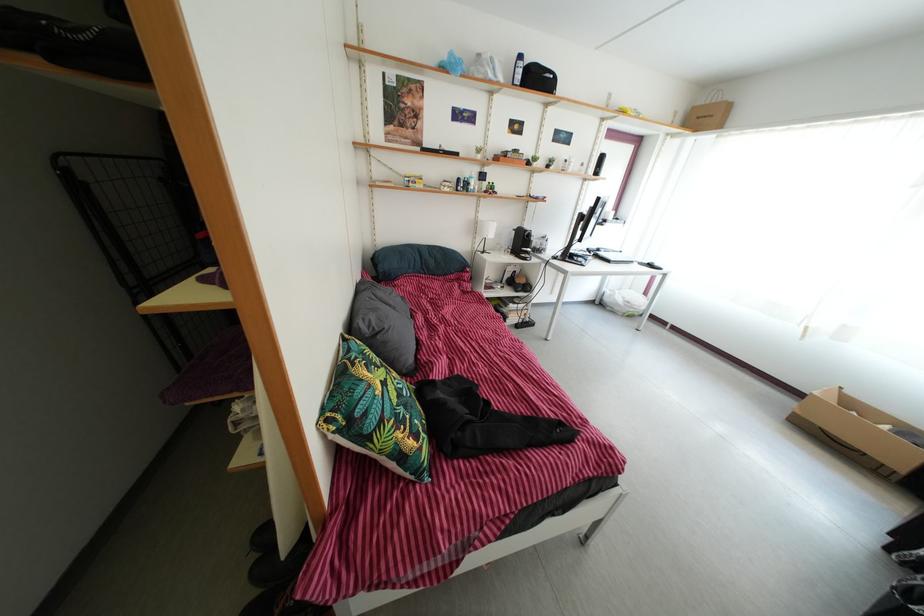
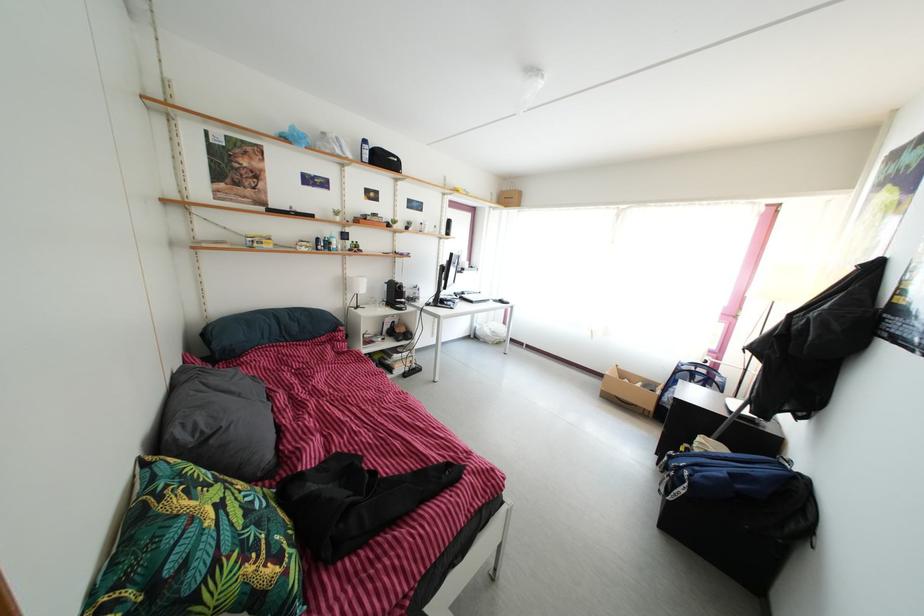
Question: The images are taken continuously from a first-person perspective. In which direction is your viewpoint rotating?

Choices:
 (A) Left
 (B) Right
 (C) Up
 (D) Down

Answer: (B)